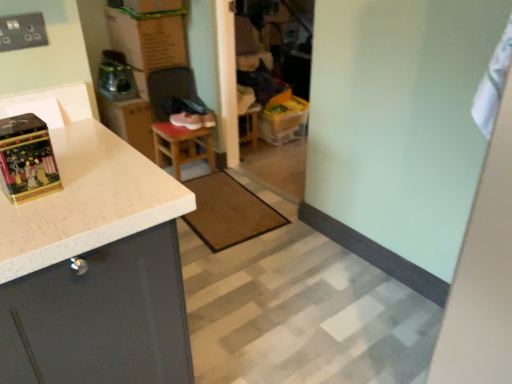
Question: Is brown textured mat at center taller or shorter than wooden stool at center?

Choices:
 (A) tall
 (B) short

Answer: (B)

Question: Based on their positions, is brown textured mat at center located to the left or right of wooden stool at center?

Choices:
 (A) right
 (B) left

Answer: (A)

Question: Which object is positioned farthest from the brown textured mat at center?

Choices:
 (A) gold metallic box at left
 (B) cardboard box at upper center
 (C) white fabric at upper right
 (D) white speckled laminate cabinet at left
 (E) wooden stool at center

Answer: (C)

Question: Estimate the real-world distances between objects in this image. Which object is farther from the gold metallic box at left?

Choices:
 (A) white fabric at upper right
 (B) brown textured mat at center
 (C) pink suede shoe at center
 (D) cardboard box at upper center
 (E) wooden stool at center

Answer: (D)